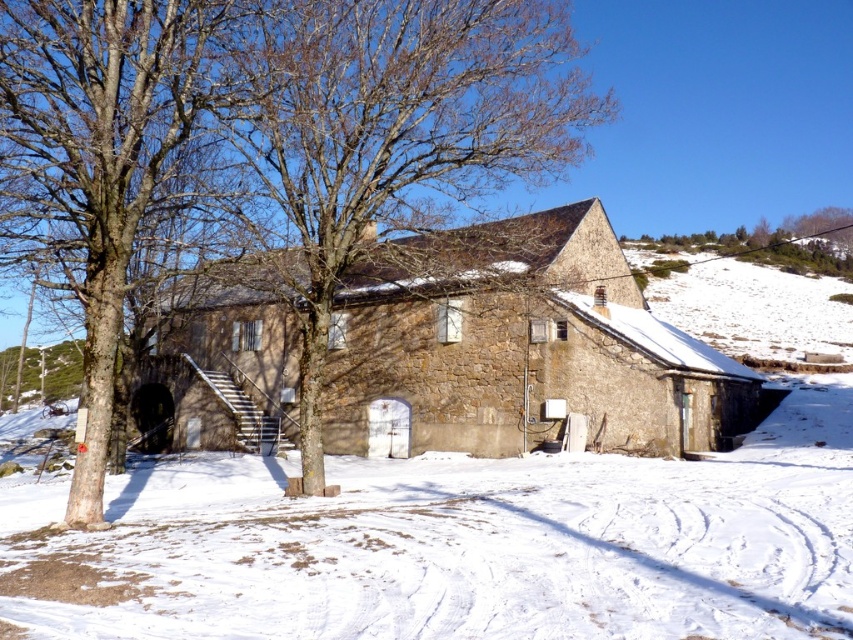
Based on the photo, is brown bark tree at center in front of brown bark tree at left?

No, it is behind brown bark tree at left.

Does brown bark tree at center have a lesser height compared to brown bark tree at left?

In fact, brown bark tree at center may be taller than brown bark tree at left.

At what (x,y) coordinates should I click in order to perform the action: click on brown bark tree at center. Please return your answer as a coordinate pair (x, y). Looking at the image, I should click on (383, 140).

In order to click on brown bark tree at center in this screenshot , I will do click(x=383, y=140).

Which is in front, point (102, 412) or point (653, 272)?

Point (102, 412) is in front.

Does brown bark tree at left lie behind green leafy tree at upper right?

No, it is in front of green leafy tree at upper right.

Does point (33, 17) come in front of point (792, 218)?

Yes, point (33, 17) is in front of point (792, 218).

The width and height of the screenshot is (853, 640). Find the location of `brown bark tree at left`. brown bark tree at left is located at coordinates (99, 160).

Which of these two, brown bark tree at center or green leafy tree at upper right, stands shorter?

Standing shorter between the two is green leafy tree at upper right.

Where is `brown bark tree at center`? Image resolution: width=853 pixels, height=640 pixels. brown bark tree at center is located at coordinates (383, 140).

What do you see at coordinates (383, 140) in the screenshot? This screenshot has height=640, width=853. I see `brown bark tree at center` at bounding box center [383, 140].

Locate an element on the screen. This screenshot has height=640, width=853. brown bark tree at center is located at coordinates (383, 140).